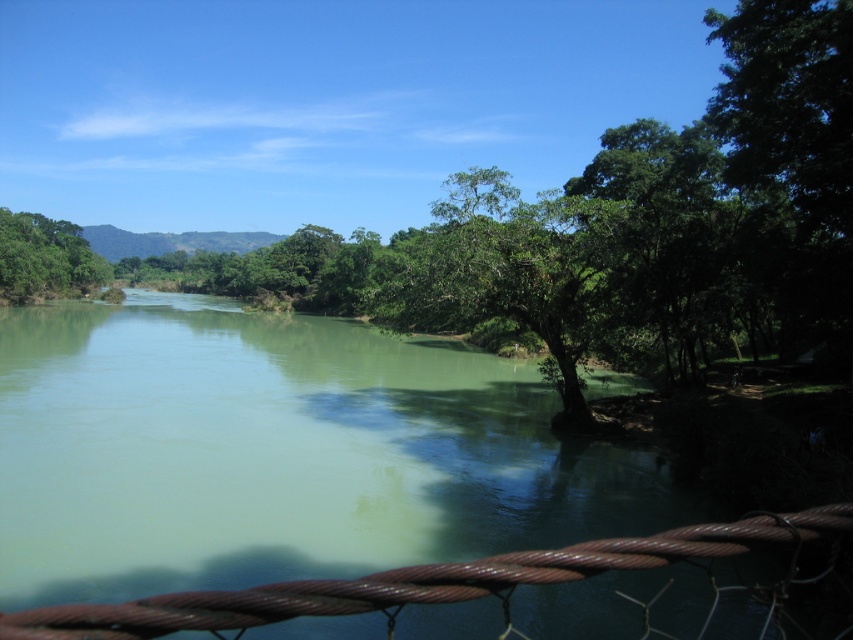
Measure the distance from green leafy tree at center to green leafy tree at upper left.

green leafy tree at center is 77.56 meters away from green leafy tree at upper left.

Measure the distance between point [467,176] and camera.

26.90 meters

Is point (567, 202) closer to camera compared to point (10, 264)?

Yes.

At what (x,y) coordinates should I click in order to perform the action: click on green leafy tree at center. Please return your answer as a coordinate pair (x, y). Looking at the image, I should click on click(x=509, y=273).

Can you confirm if rusty wire rope at lower center is positioned below green leafy tree at upper left?

Yes, rusty wire rope at lower center is below green leafy tree at upper left.

Does rusty wire rope at lower center have a smaller size compared to green leafy tree at upper left?

Indeed, rusty wire rope at lower center has a smaller size compared to green leafy tree at upper left.

Identify the location of rusty wire rope at lower center. The height and width of the screenshot is (640, 853). (415, 580).

At what (x,y) coordinates should I click in order to perform the action: click on rusty wire rope at lower center. Please return your answer as a coordinate pair (x, y). This screenshot has height=640, width=853. Looking at the image, I should click on (415, 580).

Is green leafy tree at center smaller than rusty wire rope at lower center?

Actually, green leafy tree at center might be larger than rusty wire rope at lower center.

Is the position of green leafy tree at center less distant than that of rusty wire rope at lower center?

No, it is not.

Is point (608, 200) closer to viewer compared to point (311, 586)?

No, (608, 200) is behind (311, 586).

Identify the location of green leafy tree at center. This screenshot has height=640, width=853. (509, 273).